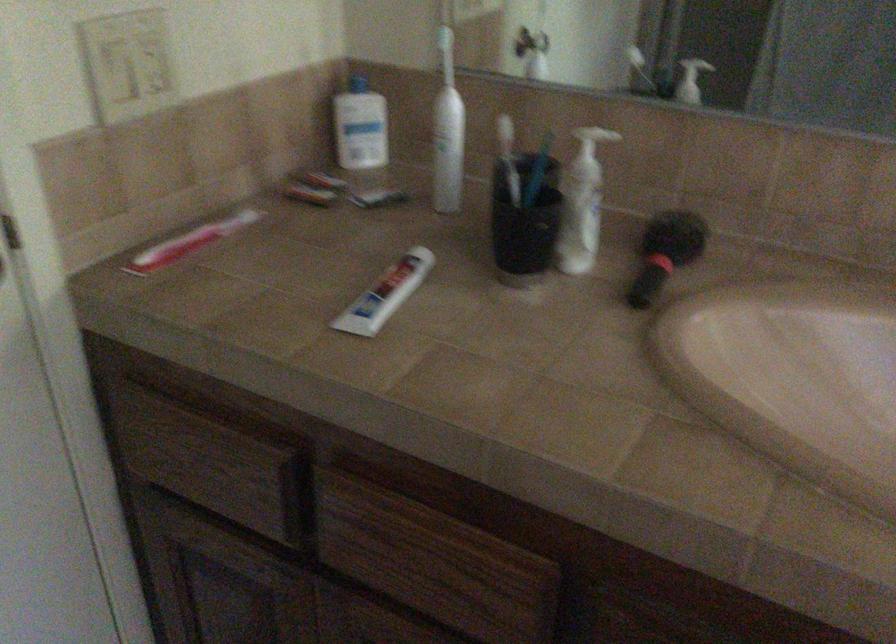
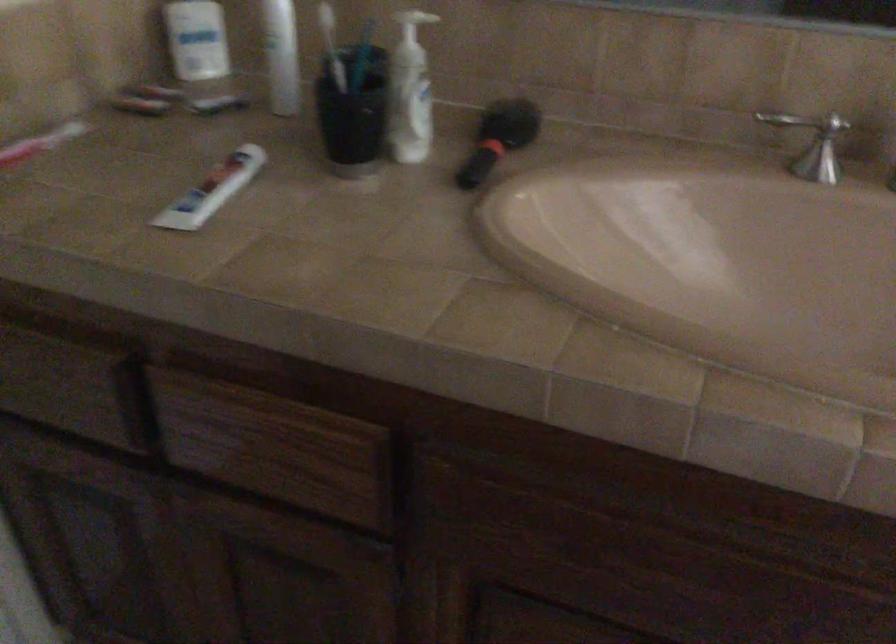
Question: The camera is either moving clockwise (left) or counter-clockwise (right) around the object. The first image is from the beginning of the video and the second image is from the end. Is the camera moving left or right when shooting the video?

Choices:
 (A) Left
 (B) Right

Answer: (A)